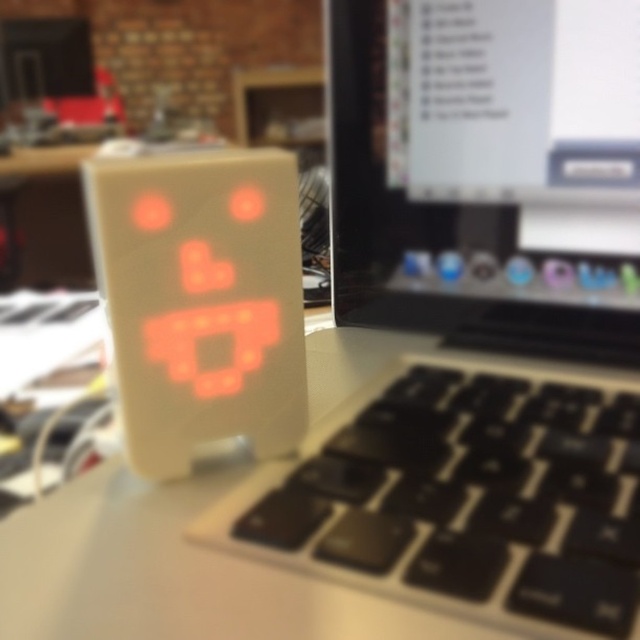
You are trying to locate the matte black laptop at center in the image. According to the coordinates provided, where would you find it?

The matte black laptop at center is located at point (476, 320).

You are trying to place a new keyboard on your desk. The desk has limited space. You see the point marked at coordinates point (476, 320). What object is located at that point?

The point (476, 320) marks the location of the matte black laptop at center.